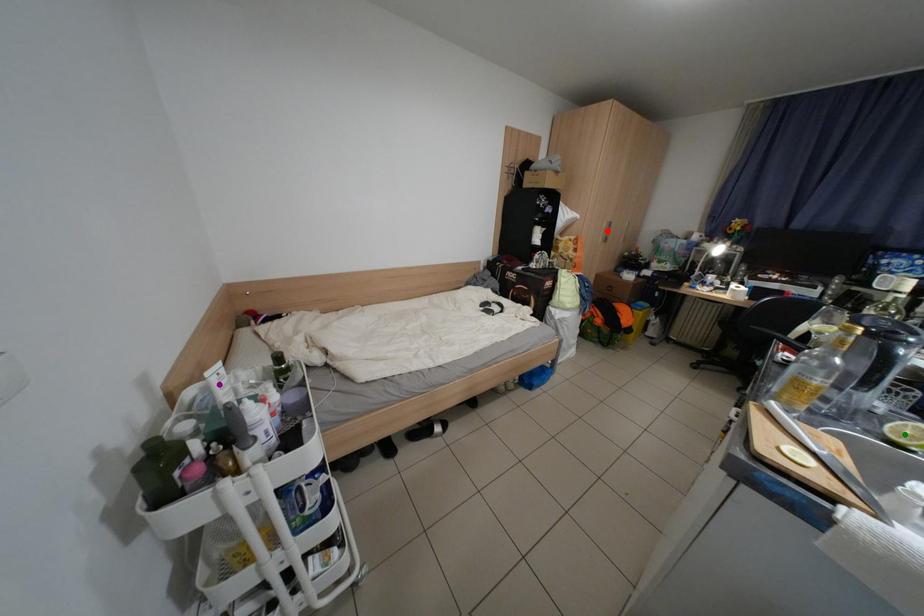
Order these from nearest to farthest:
purple point | red point | green point

1. green point
2. purple point
3. red point